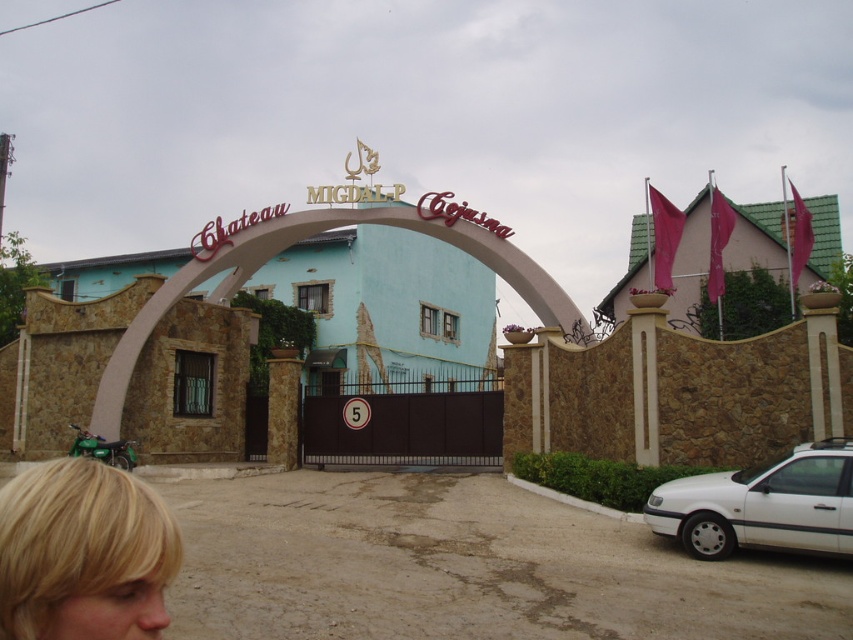
Question: Which object is the closest to the blonde hair at lower left?

Choices:
 (A) stone archway at center
 (B) white matte car at lower right
 (C) brown stone window at center

Answer: (B)

Question: Does blonde hair at lower left come behind white matte car at lower right?

Choices:
 (A) no
 (B) yes

Answer: (A)

Question: Is stone archway at center below brown stone window at center?

Choices:
 (A) yes
 (B) no

Answer: (B)

Question: Which of these objects is positioned closest to the blonde hair at lower left?

Choices:
 (A) brown stone window at center
 (B) stone archway at center
 (C) white matte car at lower right

Answer: (C)

Question: Among these objects, which one is nearest to the camera?

Choices:
 (A) blonde hair at lower left
 (B) white matte car at lower right
 (C) brown stone window at center
 (D) stone archway at center

Answer: (A)

Question: Is stone archway at center wider than brown stone window at center?

Choices:
 (A) no
 (B) yes

Answer: (B)